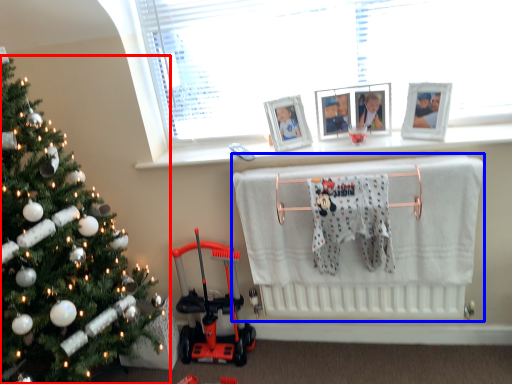
Question: Which point is further to the camera, christmas tree (highlighted by a red box) or infant bed (highlighted by a blue box)?

Choices:
 (A) christmas tree
 (B) infant bed

Answer: (B)